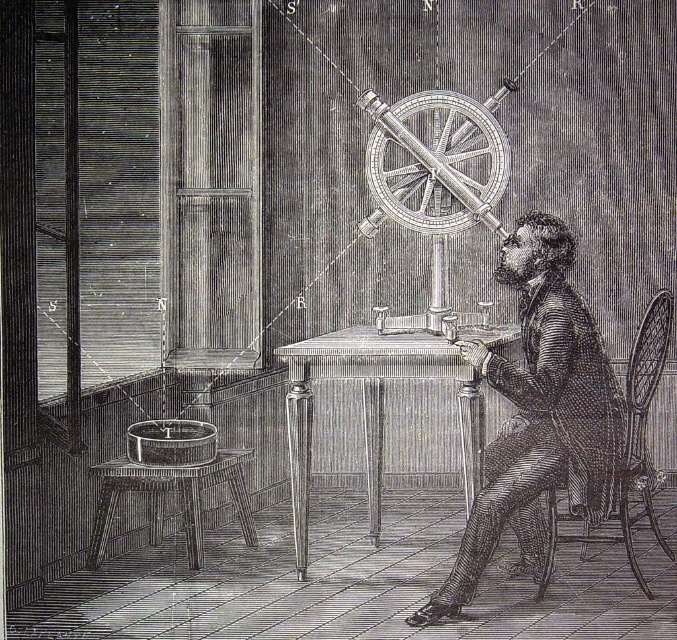
Question: Which object is the farthest from the smooth black coat at center?

Choices:
 (A) wooden table at center
 (B) metallic/textured wheel at center
 (C) woven wood chair at right

Answer: (B)

Question: Is the position of smooth black coat at center less distant than that of wooden table at center?

Choices:
 (A) yes
 (B) no

Answer: (A)

Question: Which object is farther from the camera taking this photo?

Choices:
 (A) smooth black coat at center
 (B) wooden table at center
 (C) metallic/textured wheel at center

Answer: (C)

Question: Does smooth black coat at center appear on the right side of wooden table at center?

Choices:
 (A) no
 (B) yes

Answer: (B)

Question: Which of these objects is positioned closest to the woven wood chair at right?

Choices:
 (A) wooden table at center
 (B) metallic/textured wheel at center
 (C) smooth black coat at center

Answer: (C)

Question: From the image, what is the correct spatial relationship of smooth black coat at center in relation to wooden table at center?

Choices:
 (A) below
 (B) above

Answer: (B)